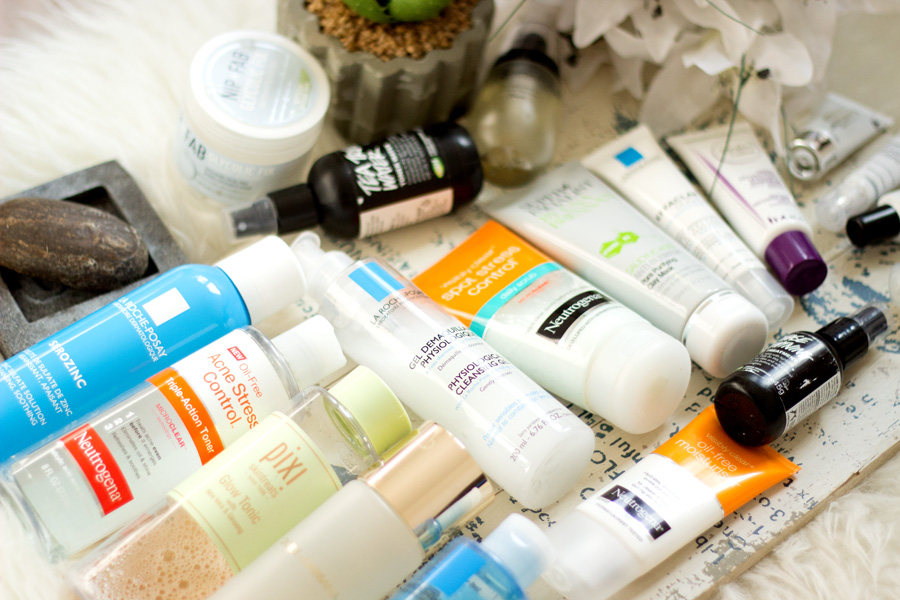
The height and width of the screenshot is (600, 900). I want to click on plant, so click(x=409, y=6).